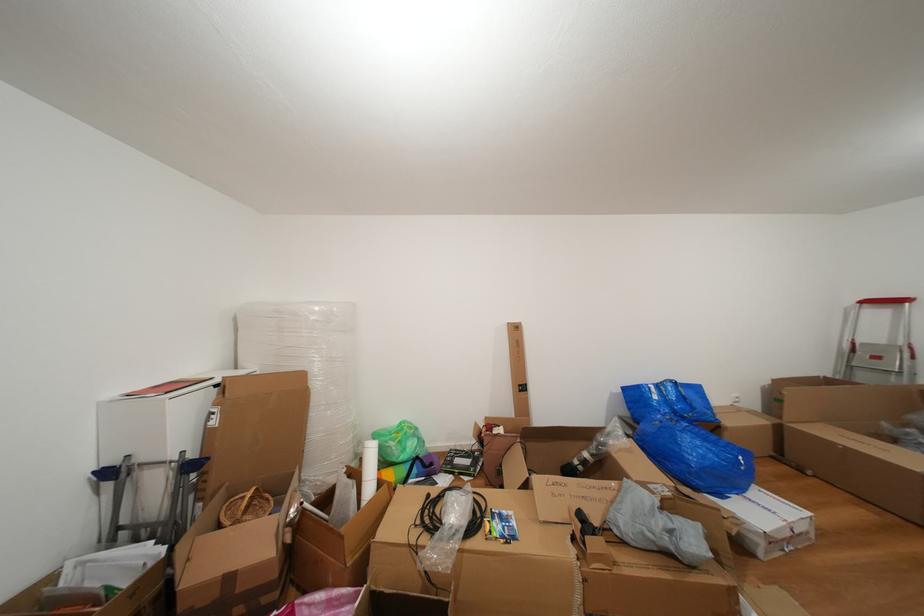
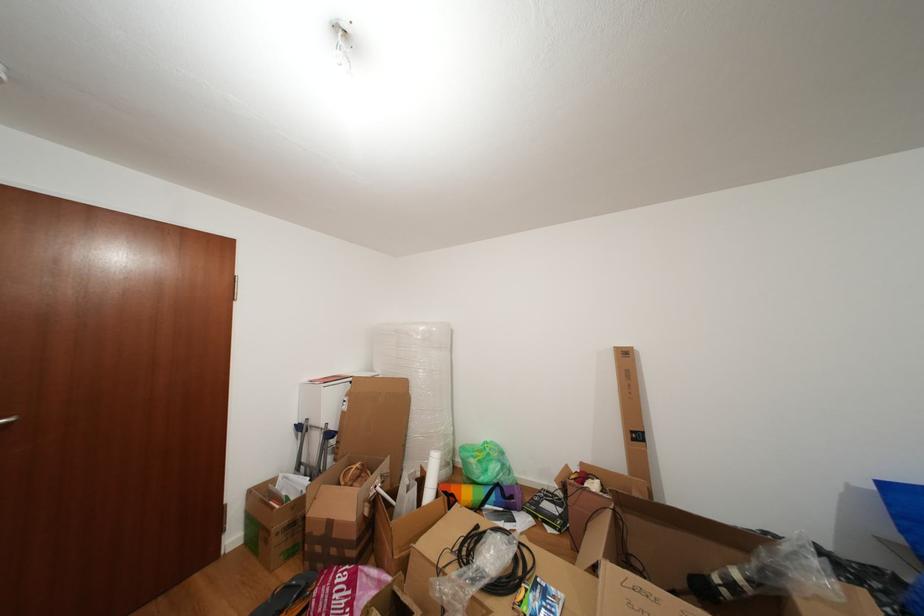
Find the pixel in the second image that matches (x=237, y=584) in the first image.

(338, 529)